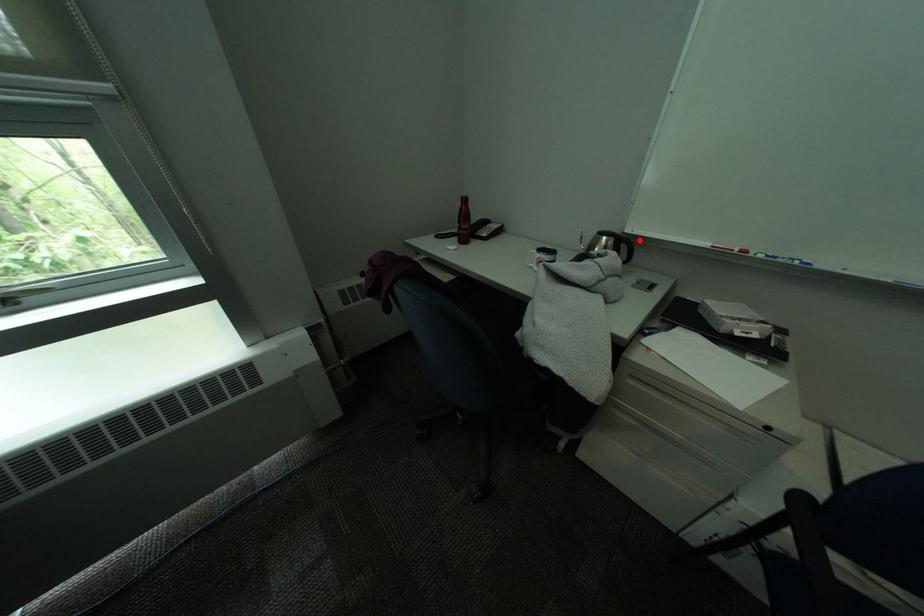
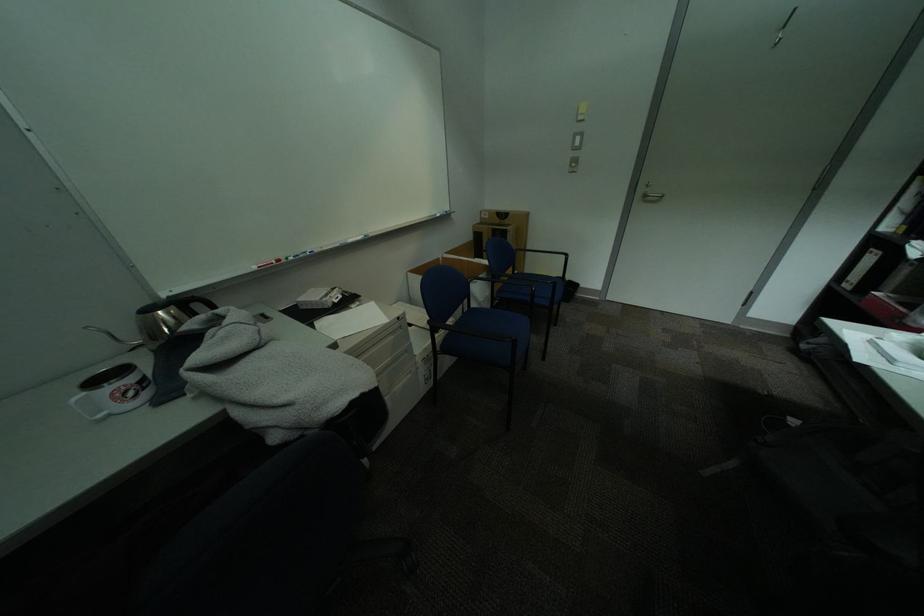
The point at the highlighted location is marked in the first image. Where is the corresponding point in the second image?

(204, 297)